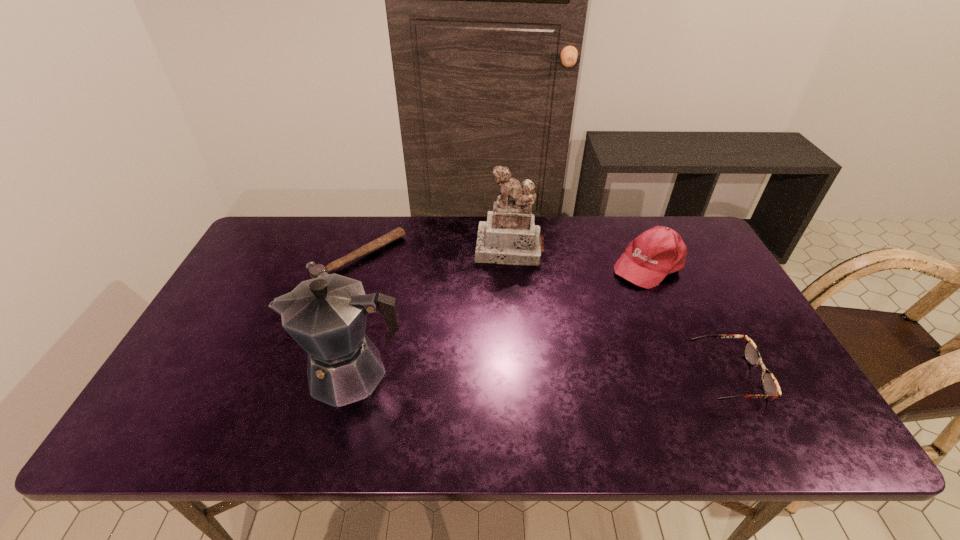
Identify the location of coffeepot. The image size is (960, 540). (326, 316).

Locate an element on the screen. spectacles is located at coordinates 770,386.

Where is `baseball cap`? baseball cap is located at coordinates (649, 258).

Locate an element on the screen. The width and height of the screenshot is (960, 540). figurine is located at coordinates (510, 236).

Locate an element on the screen. the shortest object is located at coordinates (315, 270).

This screenshot has width=960, height=540. Identify the location of free space located 0.210m at the spout of the coffeepot. click(x=211, y=373).

The image size is (960, 540). I want to click on vacant space located at the spout of the coffeepot, so click(252, 373).

Where is `vacant space situated 0.370m at the front of the third tallest object with the brim`? vacant space situated 0.370m at the front of the third tallest object with the brim is located at coordinates (543, 346).

I want to click on free space located 0.070m at the front of the third tallest object with the brim, so click(612, 292).

Where is `vacant space located at the front of the third tallest object with the brim`? The width and height of the screenshot is (960, 540). vacant space located at the front of the third tallest object with the brim is located at coordinates (612, 292).